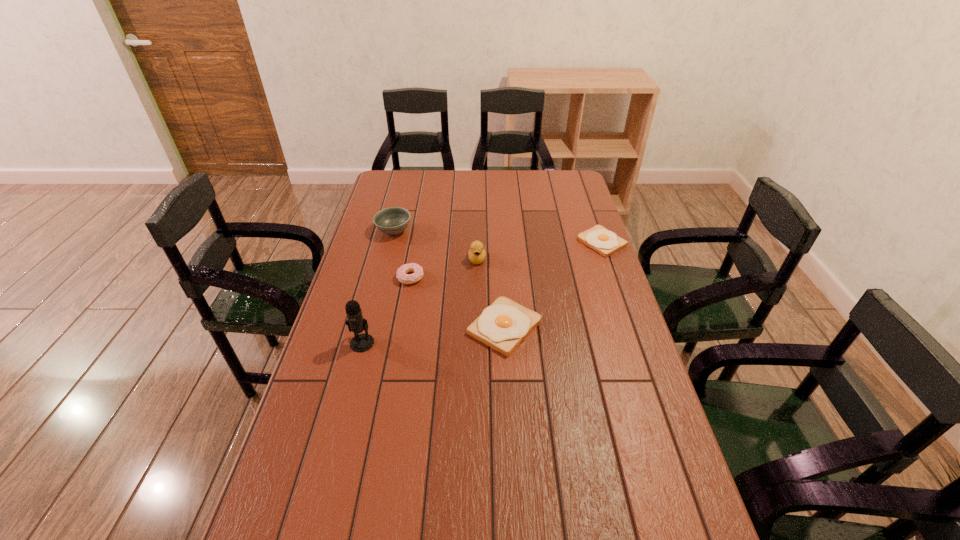
Locate an element on the screen. The image size is (960, 540). free point that keeps the toasts evenly spaced on the left is located at coordinates (345, 467).